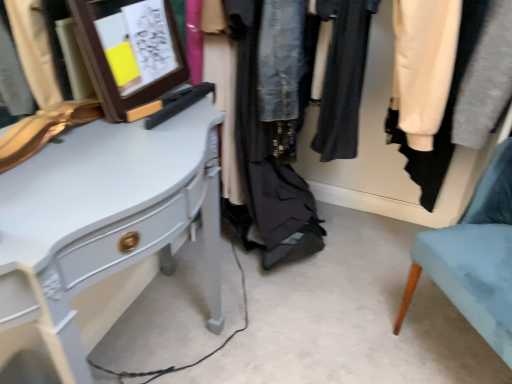
Locate an element on the screen. This screenshot has width=512, height=384. free space to the back side of light blue fabric chair at lower right is located at coordinates (387, 264).